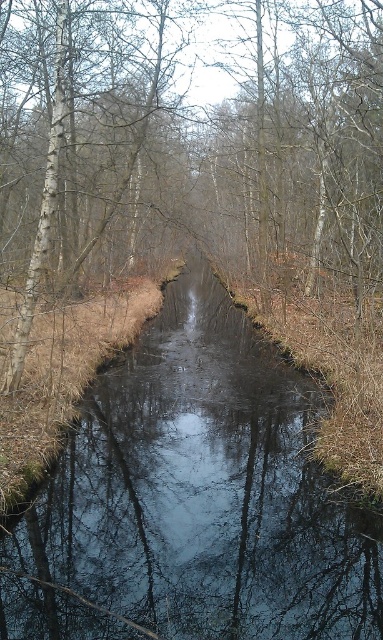
Does dark reflective water at center appear on the right side of brown smooth tree at center?

Correct, you'll find dark reflective water at center to the right of brown smooth tree at center.

Which is behind, point (140, 385) or point (178, 205)?

Positioned behind is point (178, 205).

The image size is (383, 640). I want to click on dark reflective water at center, so click(204, 490).